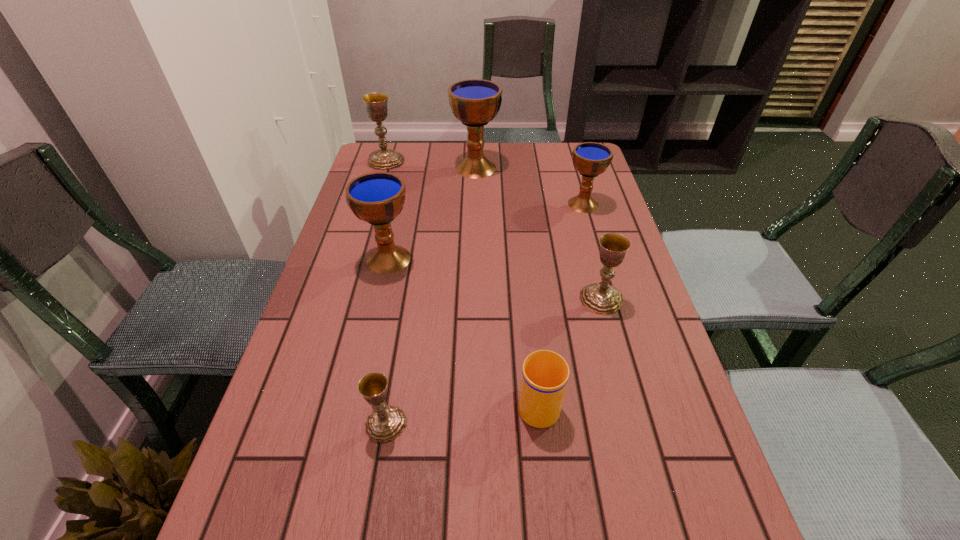
Locate an element on the screen. The width and height of the screenshot is (960, 540). the biggest blue chalice is located at coordinates (475, 102).

You are a GUI agent. You are given a task and a screenshot of the screen. Output one action in this format:
    pyautogui.click(x=<x>, y=<y>)
    Task: Click on the tallest chalice
    This screenshot has width=960, height=540.
    Given the screenshot: What is the action you would take?
    pyautogui.click(x=475, y=102)

Find the location of a particular element. The image size is (960, 540). the farthest gold chalice is located at coordinates (376, 103).

This screenshot has width=960, height=540. I want to click on the leftmost gold chalice, so click(x=376, y=103).

Where is `the nearest blue chalice`? The width and height of the screenshot is (960, 540). the nearest blue chalice is located at coordinates (377, 198).

At what (x,y) coordinates should I click in order to perform the action: click on the fourth nearest object. Please return your answer as a coordinate pair (x, y). Looking at the image, I should click on (377, 198).

Where is `the third nearest object`? The image size is (960, 540). the third nearest object is located at coordinates (602, 298).

Where is `the second smallest gold chalice`? This screenshot has width=960, height=540. the second smallest gold chalice is located at coordinates (602, 298).

Find the location of `the rightmost blue chalice`. the rightmost blue chalice is located at coordinates (590, 159).

At what (x,y) coordinates should I click in order to perform the action: click on the smallest blue chalice. Please return your answer as a coordinate pair (x, y). This screenshot has width=960, height=540. Looking at the image, I should click on (590, 159).